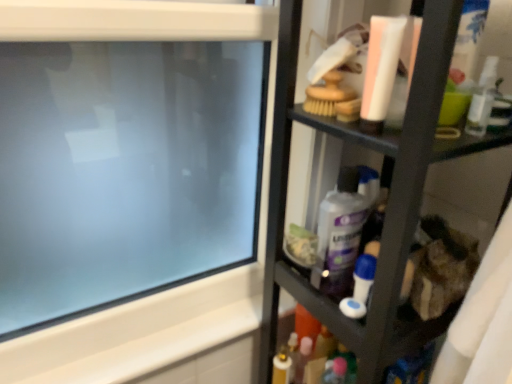
Describe the element at coordinates (389, 197) in the screenshot. I see `black plastic shelf at right` at that location.

Find the location of a particular element. The width and height of the screenshot is (512, 384). purple glossy bottle at center is located at coordinates (340, 234).

From the image's perspective, which object appears higher, black plastic shelf at right or blue plastic toothbrush at center-right?

blue plastic toothbrush at center-right, from the image's perspective.

Is black plastic shelf at right thinner than blue plastic toothbrush at center-right?

No, black plastic shelf at right is not thinner than blue plastic toothbrush at center-right.

Which object is further away from the camera taking this photo, black plastic shelf at right or blue plastic toothbrush at center-right?

blue plastic toothbrush at center-right.

Considering the relative sizes of transparent glass computer screen at upper left and black plastic shelf at right in the image provided, is transparent glass computer screen at upper left bigger than black plastic shelf at right?

No.

How distant is transparent glass computer screen at upper left from black plastic shelf at right?

13.35 inches.

From the picture: From a real-world perspective, is transparent glass computer screen at upper left positioned over black plastic shelf at right based on gravity?

Yes, from a real-world perspective, transparent glass computer screen at upper left is over black plastic shelf at right

Is transparent glass computer screen at upper left aimed at black plastic shelf at right?

Yes, transparent glass computer screen at upper left is turned towards black plastic shelf at right.

Measure the distance between blue plastic toothbrush at center-right and transparent glass computer screen at upper left.

They are 22.23 inches apart.

From the image's perspective, is blue plastic toothbrush at center-right above or below transparent glass computer screen at upper left?

Based on their image positions, blue plastic toothbrush at center-right is located beneath transparent glass computer screen at upper left.

From a real-world perspective, which object rests below the other?

blue plastic toothbrush at center-right is physically lower.

Considering the positions of point (357, 276) and point (230, 183), is point (357, 276) closer or farther from the camera than point (230, 183)?

Point (357, 276) is closer to the camera than point (230, 183).

Who is more distant, purple glossy bottle at center or blue plastic toothbrush at center-right?

blue plastic toothbrush at center-right is more distant.

Choose the correct answer: Is purple glossy bottle at center inside blue plastic toothbrush at center-right or outside it?

purple glossy bottle at center is not enclosed by blue plastic toothbrush at center-right.

At what (x,y) coordinates should I click in order to perform the action: click on cleaning product in front of the blue plastic toothbrush at center-right. Please return your answer as a coordinate pair (x, y). The width and height of the screenshot is (512, 384). Looking at the image, I should click on (340, 234).

Which is closer, (x=344, y=212) or (x=365, y=263)?

Clearly, point (x=344, y=212) is closer to the camera than point (x=365, y=263).

From the image's perspective, is purple glossy bottle at center positioned above or below black plastic shelf at right?

Clearly, from the image's perspective, purple glossy bottle at center is above black plastic shelf at right.

Considering their positions, is purple glossy bottle at center located in front of or behind black plastic shelf at right?

purple glossy bottle at center is positioned farther from the viewer than black plastic shelf at right.

Is black plastic shelf at right surrounded by purple glossy bottle at center?

No, purple glossy bottle at center does not contain black plastic shelf at right.

Which of these two, purple glossy bottle at center or black plastic shelf at right, is wider?

Wider between the two is black plastic shelf at right.

Based on their sizes in the image, would you say black plastic shelf at right is bigger or smaller than transparent glass computer screen at upper left?

black plastic shelf at right is bigger than transparent glass computer screen at upper left.

Is black plastic shelf at right further to the viewer compared to transparent glass computer screen at upper left?

No.

Is point (396, 135) positioned in front of point (132, 72)?

Yes, point (396, 135) is closer to viewer.

From their relative heights in the image, would you say black plastic shelf at right is taller or shorter than transparent glass computer screen at upper left?

Considering their sizes, black plastic shelf at right has more height than transparent glass computer screen at upper left.

Is blue plastic toothbrush at center-right situated inside black plastic shelf at right or outside?

blue plastic toothbrush at center-right can be found inside black plastic shelf at right.

From a real-world perspective, is blue plastic toothbrush at center-right on black plastic shelf at right?

Indeed, from a real-world perspective, blue plastic toothbrush at center-right stands above black plastic shelf at right.

Is blue plastic toothbrush at center-right directly adjacent to black plastic shelf at right?

No, blue plastic toothbrush at center-right is not making contact with black plastic shelf at right.

Locate an element on the screen. This screenshot has width=512, height=384. toiletry above the black plastic shelf at right (from the image's perspective) is located at coordinates (362, 277).

I want to click on shelf that appears in front of the transparent glass computer screen at upper left, so click(x=389, y=197).

Based on their spatial positions, is black plastic shelf at right or transparent glass computer screen at upper left closer to blue plastic toothbrush at center-right?

black plastic shelf at right.

From the image, which object appears to be farther from black plastic shelf at right, blue plastic toothbrush at center-right or transparent glass computer screen at upper left?

Based on the image, transparent glass computer screen at upper left appears to be further to black plastic shelf at right.

Estimate the real-world distances between objects in this image. Which object is closer to transparent glass computer screen at upper left, black plastic shelf at right or purple glossy bottle at center?

black plastic shelf at right is positioned closer to the anchor transparent glass computer screen at upper left.

Based on their spatial positions, is transparent glass computer screen at upper left or purple glossy bottle at center closer to black plastic shelf at right?

The object closer to black plastic shelf at right is purple glossy bottle at center.

From the image, which object appears to be farther from black plastic shelf at right, purple glossy bottle at center or transparent glass computer screen at upper left?

The object further to black plastic shelf at right is transparent glass computer screen at upper left.

From the image, which object appears to be nearer to purple glossy bottle at center, black plastic shelf at right or transparent glass computer screen at upper left?

The object closer to purple glossy bottle at center is black plastic shelf at right.

Looking at this image, considering their positions, is blue plastic toothbrush at center-right positioned further to purple glossy bottle at center than transparent glass computer screen at upper left?

transparent glass computer screen at upper left lies further to purple glossy bottle at center than the other object.

Based on the photo, which object lies nearer to the anchor point purple glossy bottle at center, blue plastic toothbrush at center-right or black plastic shelf at right?

blue plastic toothbrush at center-right.

You are a GUI agent. You are given a task and a screenshot of the screen. Output one action in this format:
    pyautogui.click(x=<x>, y=<y>)
    Task: Click on the cleaning product located between transparent glass computer screen at upper left and black plastic shelf at right in the left-right direction
    This screenshot has width=512, height=384.
    Given the screenshot: What is the action you would take?
    pyautogui.click(x=340, y=234)

Image resolution: width=512 pixels, height=384 pixels. I want to click on cleaning product between transparent glass computer screen at upper left and blue plastic toothbrush at center-right in the horizontal direction, so click(x=340, y=234).

Locate an element on the screen. cleaning product between black plastic shelf at right and blue plastic toothbrush at center-right along the z-axis is located at coordinates 340,234.

This screenshot has width=512, height=384. What are the coordinates of `toiletry between transparent glass computer screen at upper left and black plastic shelf at right from left to right` in the screenshot? It's located at (362, 277).